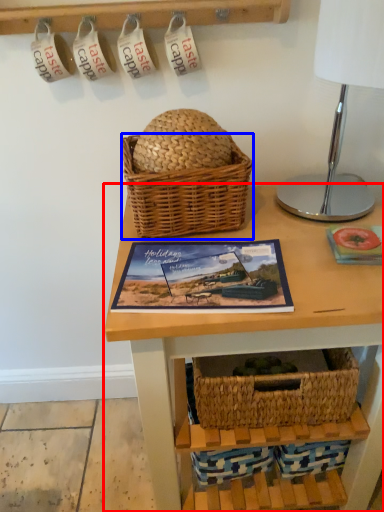
Question: Among these objects, which one is nearest to the camera, table (highlighted by a red box) or picnic basket (highlighted by a blue box)?

Choices:
 (A) table
 (B) picnic basket

Answer: (A)